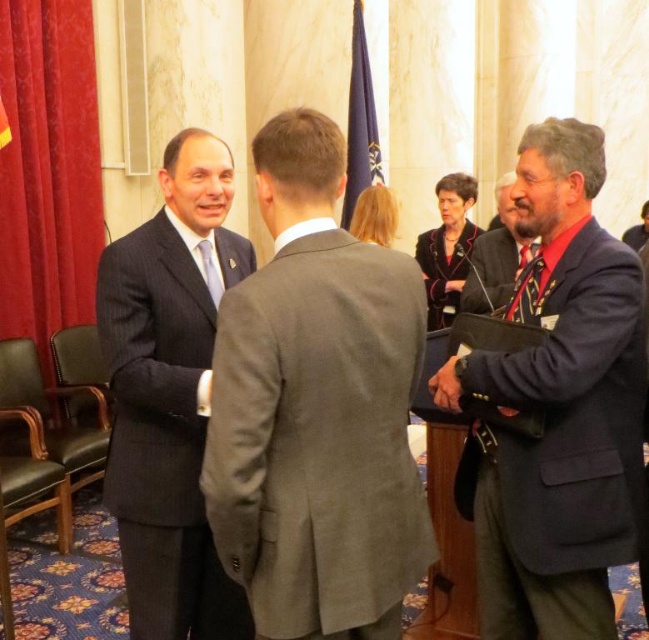
Which is more to the right, gray wool suit at center or matte black suit at right?

matte black suit at right is more to the right.

This screenshot has height=640, width=649. Describe the element at coordinates (315, 408) in the screenshot. I see `gray wool suit at center` at that location.

Describe the element at coordinates (315, 408) in the screenshot. I see `gray wool suit at center` at that location.

At what (x,y) coordinates should I click in order to perform the action: click on gray wool suit at center. Please return your answer as a coordinate pair (x, y). This screenshot has height=640, width=649. Looking at the image, I should click on [x=315, y=408].

Does matte black suit at right have a lesser width compared to dark blue wool suit at center?

Indeed, matte black suit at right has a lesser width compared to dark blue wool suit at center.

Image resolution: width=649 pixels, height=640 pixels. What do you see at coordinates (496, 257) in the screenshot?
I see `matte black suit at right` at bounding box center [496, 257].

This screenshot has height=640, width=649. Identify the location of matte black suit at right. (496, 257).

Does dark blue wool suit at center have a smaller size compared to dark blue suit at center?

Correct, dark blue wool suit at center occupies less space than dark blue suit at center.

Is dark blue wool suit at center to the right of dark blue suit at center from the viewer's perspective?

In fact, dark blue wool suit at center is to the left of dark blue suit at center.

Is point (424, 276) positioned after point (630, 237)?

No, (424, 276) is in front of (630, 237).

Locate an element on the screen. This screenshot has height=640, width=649. dark blue wool suit at center is located at coordinates (445, 269).